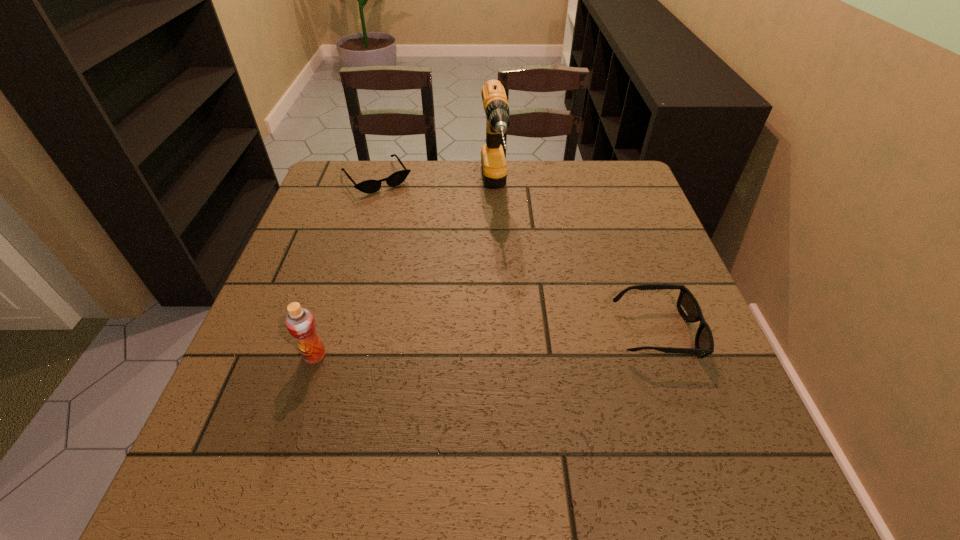
Where is `free space that is in between the orange juice and the nearer sunglasses`? This screenshot has width=960, height=540. free space that is in between the orange juice and the nearer sunglasses is located at coordinates [486, 344].

At what (x,y) coordinates should I click in order to perform the action: click on free space between the third shortest object and the farther sunglasses. Please return your answer as a coordinate pair (x, y). This screenshot has height=540, width=960. Looking at the image, I should click on (346, 267).

Find the location of a particular element. This screenshot has height=540, width=960. vacant region between the nearer sunglasses and the third shortest object is located at coordinates (486, 344).

Identify the location of empty space that is in between the tallest object and the third shortest object. The image size is (960, 540). click(x=404, y=274).

At what (x,y) coordinates should I click in order to perform the action: click on empty location between the shorter sunglasses and the right sunglasses. Please return your answer as a coordinate pair (x, y). Looking at the image, I should click on (516, 255).

The image size is (960, 540). Identify the location of free spot between the taller sunglasses and the third shortest object. (486, 344).

This screenshot has width=960, height=540. In order to click on free space that is in between the drill and the shortest object in this screenshot , I will do `click(435, 185)`.

This screenshot has width=960, height=540. I want to click on the second closest object to the orange juice, so click(x=368, y=186).

This screenshot has height=540, width=960. In order to click on object that ranks as the second closest to the second object from right to left in this screenshot , I will do `click(687, 305)`.

Find the location of `vacant space that satisfies the following two spatial constraints: 1. on the front side of the third tallest object; 2. on the front-facing side of the third object from left to right`. vacant space that satisfies the following two spatial constraints: 1. on the front side of the third tallest object; 2. on the front-facing side of the third object from left to right is located at coordinates (499, 333).